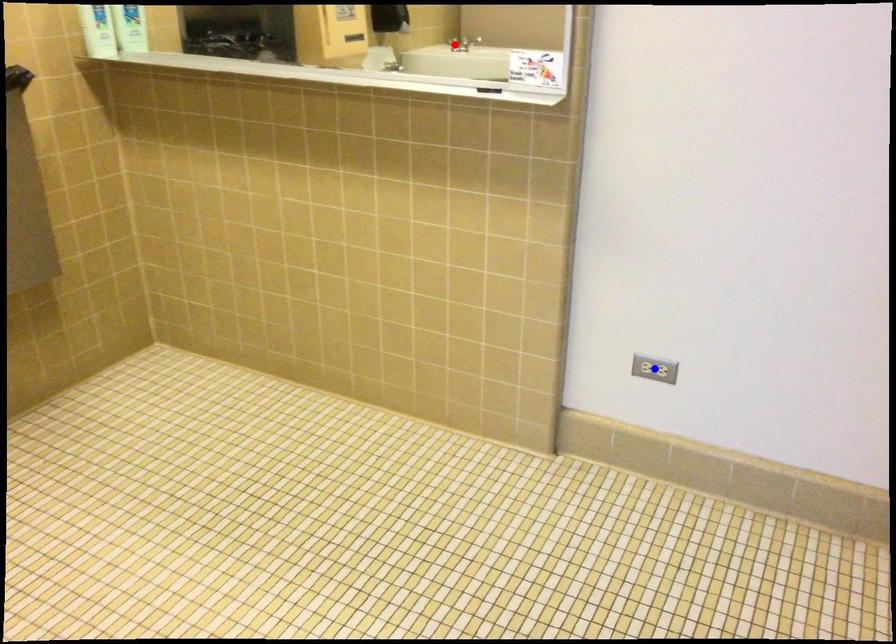
Question: Two points are marked on the image. Which point is closer to the camera?

Choices:
 (A) Blue point is closer.
 (B) Red point is closer.

Answer: (A)